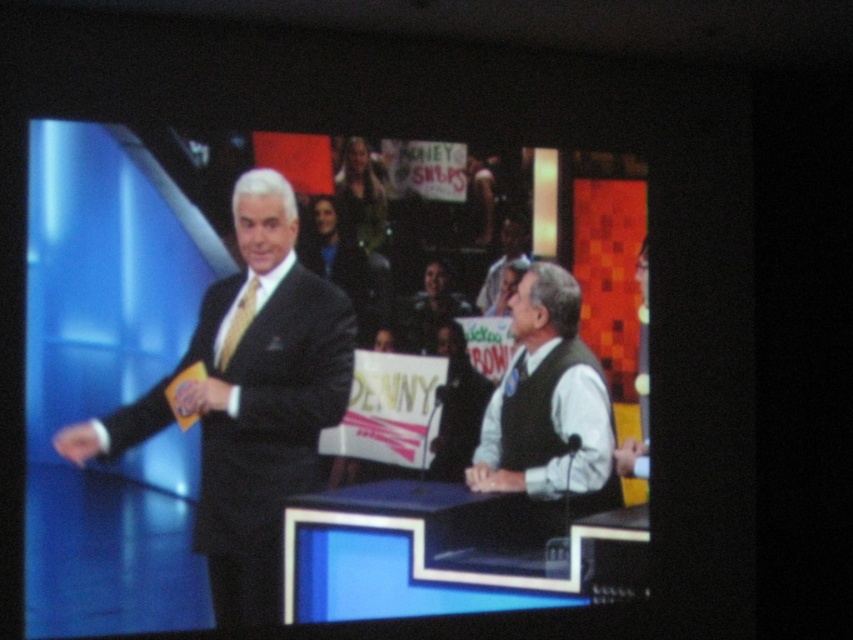
Who is lower down, shiny black suit at left or white matte vest at center?

Positioned lower is white matte vest at center.

Locate an element on the screen. shiny black suit at left is located at coordinates (248, 400).